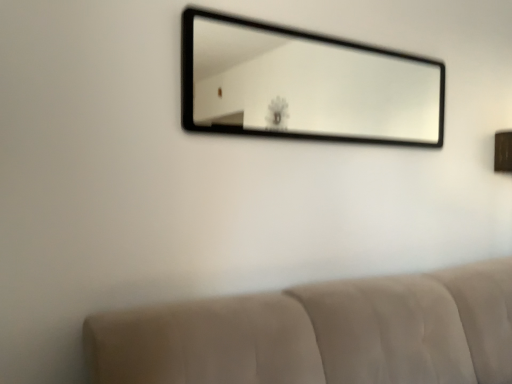
Question: Should I look upward or downward to see black glass mirror at upper center?

Choices:
 (A) down
 (B) up

Answer: (B)

Question: Is the surface of black glass mirror at upper center in direct contact with beige fabric couch at lower center?

Choices:
 (A) no
 (B) yes

Answer: (A)

Question: Considering the relative sizes of black glass mirror at upper center and beige fabric couch at lower center in the image provided, is black glass mirror at upper center thinner than beige fabric couch at lower center?

Choices:
 (A) no
 (B) yes

Answer: (B)

Question: From a real-world perspective, is black glass mirror at upper center on beige fabric couch at lower center?

Choices:
 (A) no
 (B) yes

Answer: (B)

Question: Is black glass mirror at upper center positioned behind beige fabric couch at lower center?

Choices:
 (A) no
 (B) yes

Answer: (B)

Question: Is black glass mirror at upper center bigger than beige fabric couch at lower center?

Choices:
 (A) yes
 (B) no

Answer: (B)

Question: Is black glass mirror at upper center not close to beige fabric couch at lower center?

Choices:
 (A) yes
 (B) no

Answer: (A)

Question: Is beige fabric couch at lower center smaller than black glass mirror at upper center?

Choices:
 (A) yes
 (B) no

Answer: (B)

Question: Is beige fabric couch at lower center in front of black glass mirror at upper center?

Choices:
 (A) no
 (B) yes

Answer: (B)

Question: From the image's perspective, is beige fabric couch at lower center under black glass mirror at upper center?

Choices:
 (A) yes
 (B) no

Answer: (A)

Question: Does beige fabric couch at lower center have a larger size compared to black glass mirror at upper center?

Choices:
 (A) no
 (B) yes

Answer: (B)

Question: From the image's perspective, does beige fabric couch at lower center appear higher than black glass mirror at upper center?

Choices:
 (A) yes
 (B) no

Answer: (B)

Question: Could you tell me if beige fabric couch at lower center is facing black glass mirror at upper center?

Choices:
 (A) no
 (B) yes

Answer: (A)

Question: Is beige fabric couch at lower center bigger or smaller than black glass mirror at upper center?

Choices:
 (A) big
 (B) small

Answer: (A)